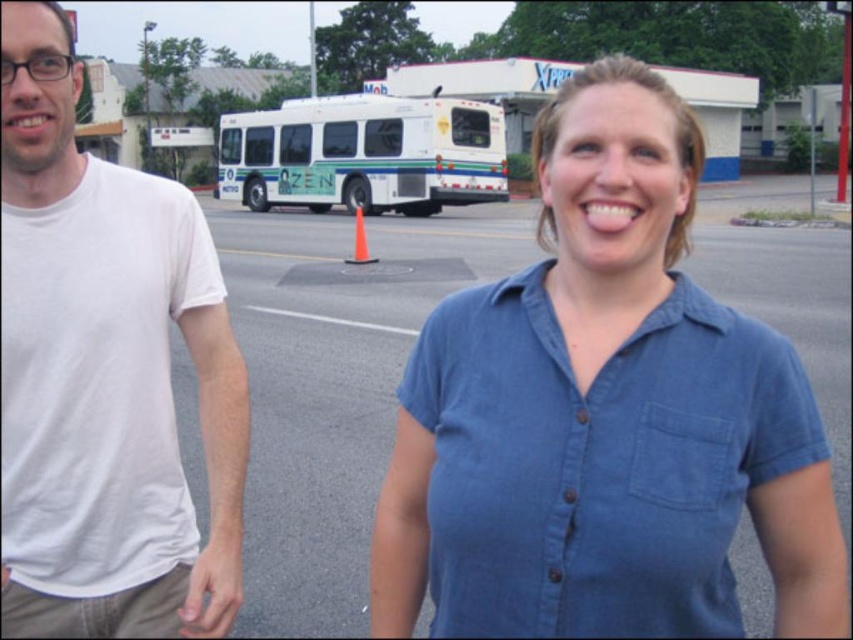
Between denim shirt at center and white matte bus at center, which one is positioned higher?

Positioned higher is white matte bus at center.

Who is more distant from viewer, (590, 470) or (312, 195)?

The point (312, 195) is behind.

Does point (675, 428) come closer to viewer compared to point (408, 129)?

Yes, point (675, 428) is in front of point (408, 129).

Locate an element on the screen. The image size is (853, 640). denim shirt at center is located at coordinates (604, 413).

Which is more to the right, denim shirt at center or white cotton t-shirt at left?

From the viewer's perspective, denim shirt at center appears more on the right side.

Does denim shirt at center appear over white cotton t-shirt at left?

Yes.

In order to click on denim shirt at center in this screenshot , I will do `click(604, 413)`.

Which is in front, point (218, 388) or point (506, 195)?

Point (218, 388) is more forward.

Can you confirm if white cotton t-shirt at left is wider than white matte bus at center?

Incorrect, white cotton t-shirt at left's width does not surpass white matte bus at center's.

At what (x,y) coordinates should I click in order to perform the action: click on white cotton t-shirt at left. Please return your answer as a coordinate pair (x, y). Looking at the image, I should click on (105, 374).

The width and height of the screenshot is (853, 640). Identify the location of white cotton t-shirt at left. 105,374.